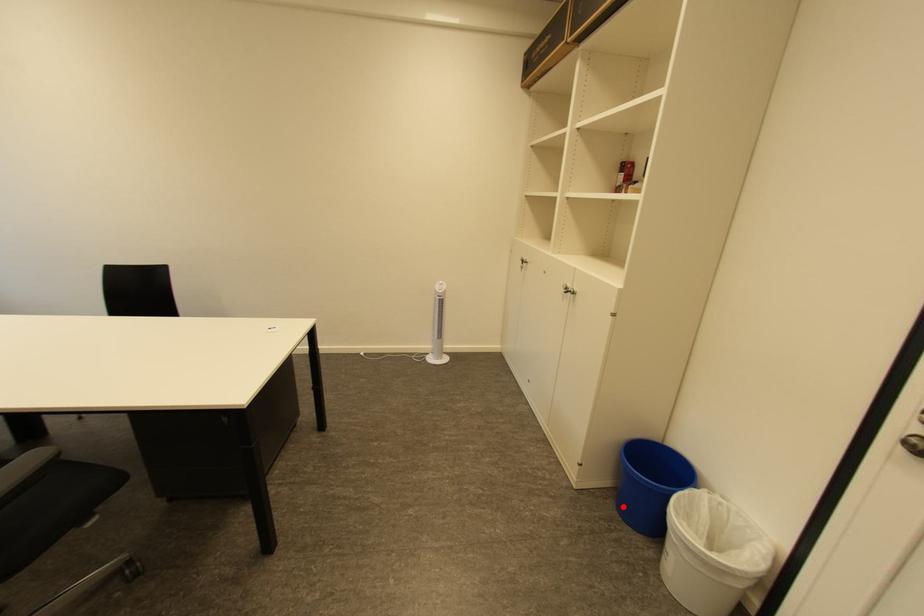
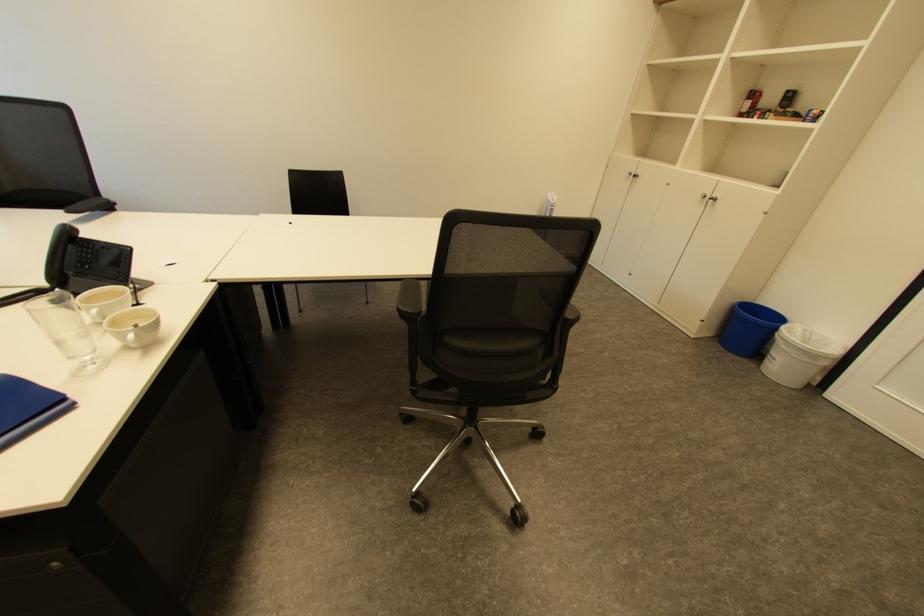
Question: I am providing you with two images of the same scene from different viewpoints. Given a red point in image1, look at the same physical point in image2. Is it:

Choices:
 (A) Closer to the viewpoint
 (B) Farther from the viewpoint

Answer: (A)